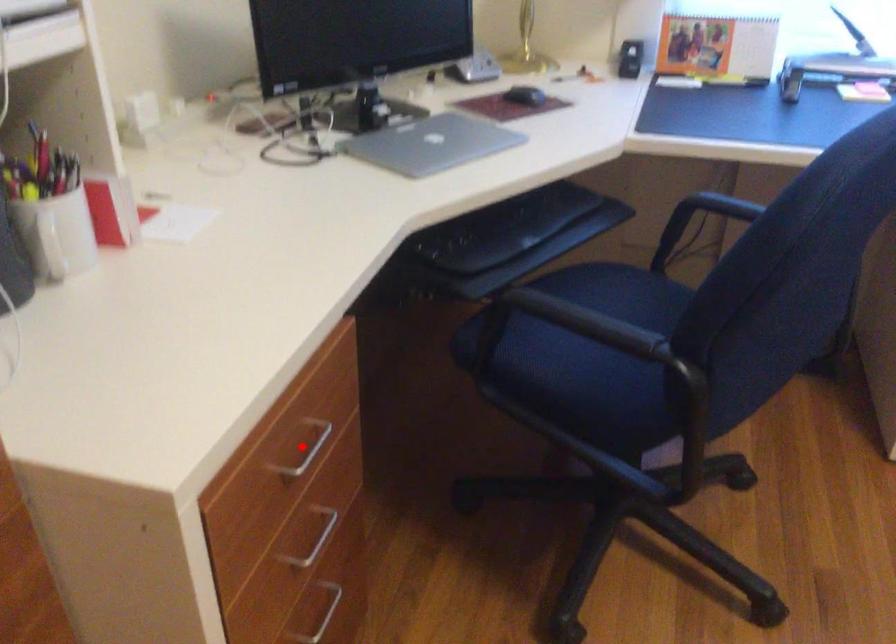
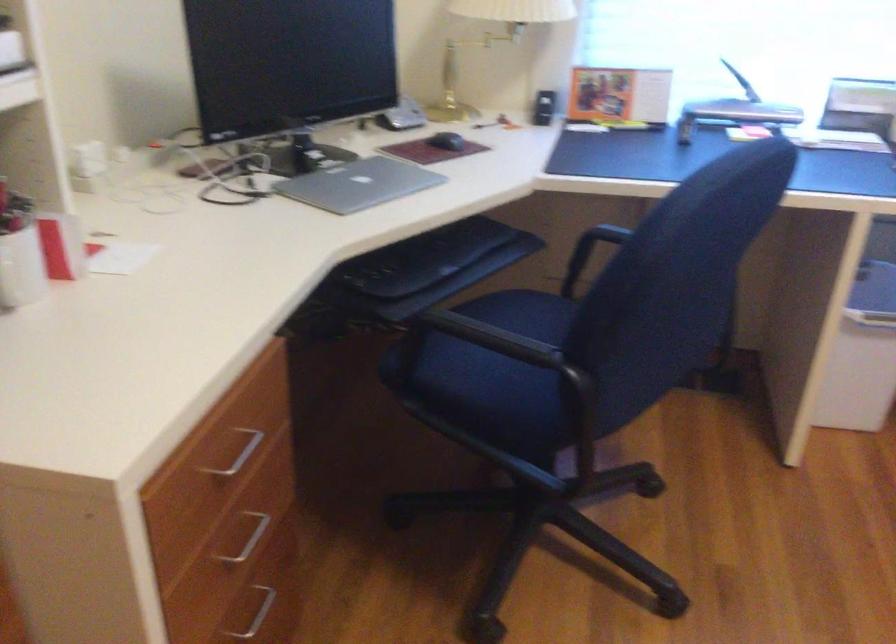
Question: I am providing you with two images of the same scene from different viewpoints. In image1, a red point is highlighted. Considering the same 3D point in image2, which of the following is correct?

Choices:
 (A) It is closer
 (B) It is farther

Answer: (B)